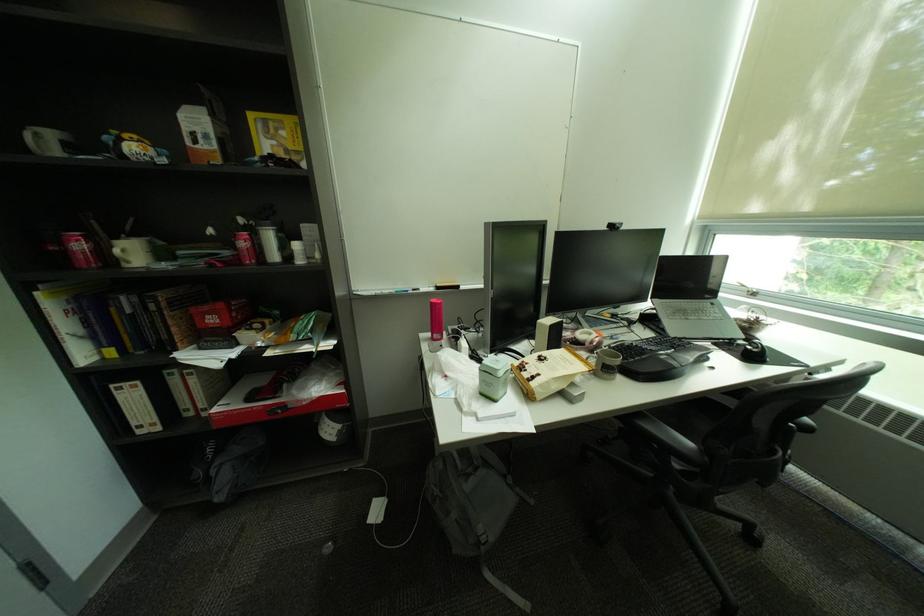
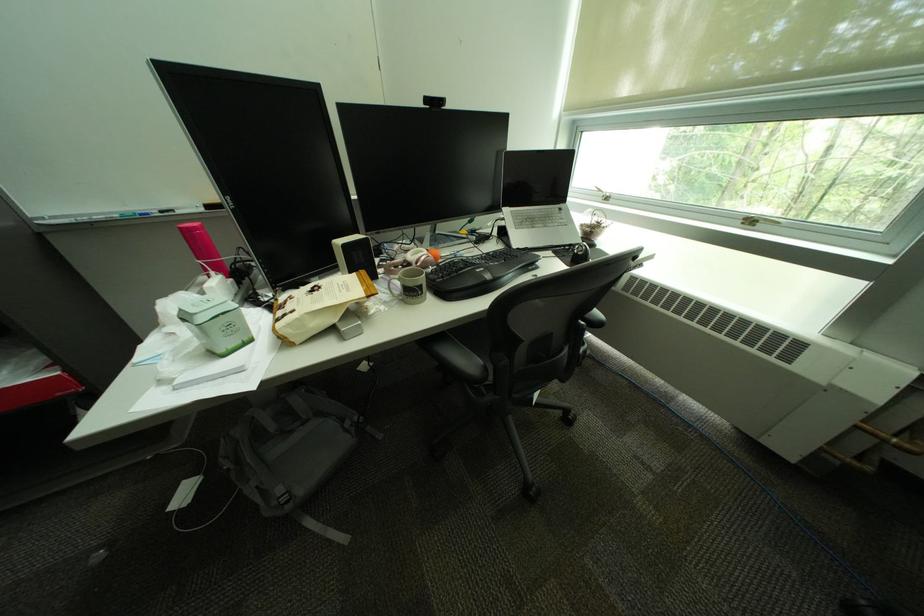
In the second image, find the point that corresponds to (x=506, y=399) in the first image.

(232, 353)